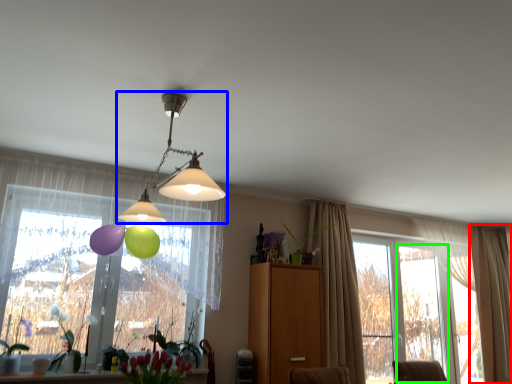
Question: Considering the real-world distances, which object is closest to curtain (highlighted by a red box)? lamp (highlighted by a blue box) or window frame (highlighted by a green box).

Choices:
 (A) lamp
 (B) window frame

Answer: (B)